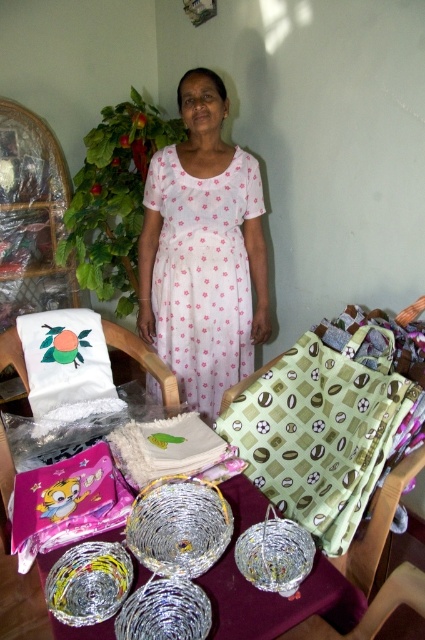
You are a photographer setting up a shoot in the scene. You need to adjust the lighting so that the white floral dress at center is illuminated without casting a shadow on the woven metallic basket at center. Is this possible given their positions?

The white floral dress at center is further to the viewer than the woven metallic basket at center, so adjusting the lighting to illuminate the dress without casting a shadow on the basket is possible since the dress is closer to the light source and the basket is behind it.

From the picture: You are a photographer setting up a shoot. You notice the white floral dress at center and the purple fabric at lower center. Which object is covering the other one on the table?

The white floral dress at center is positioned over the purple fabric at lower center, so it is covering the purple fabric at lower center.